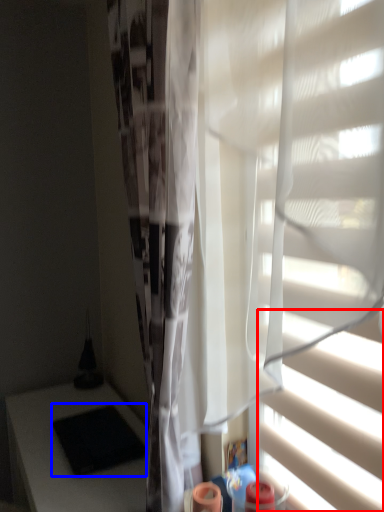
Question: Which object is closer to the camera taking this photo, blind (highlighted by a red box) or pad (highlighted by a blue box)?

Choices:
 (A) blind
 (B) pad

Answer: (A)